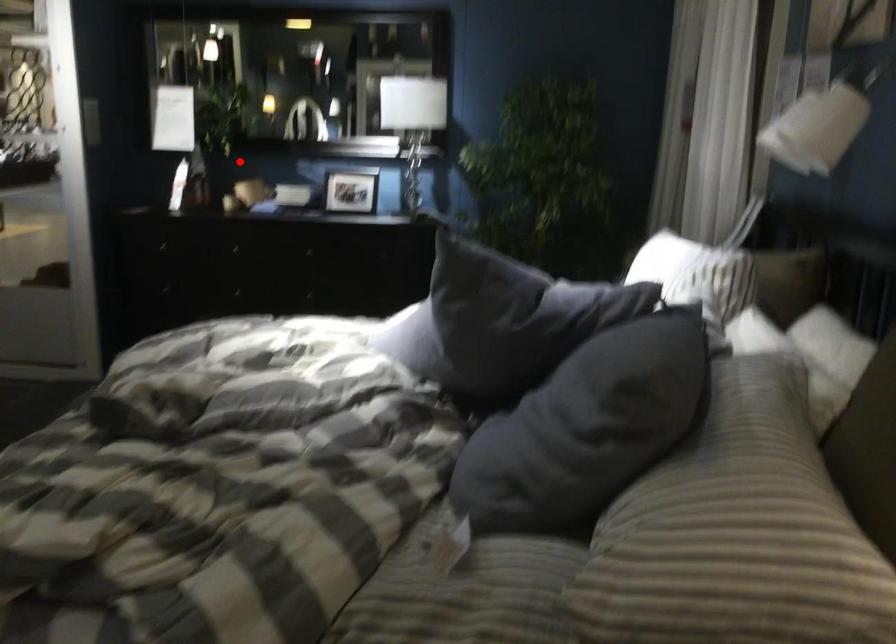
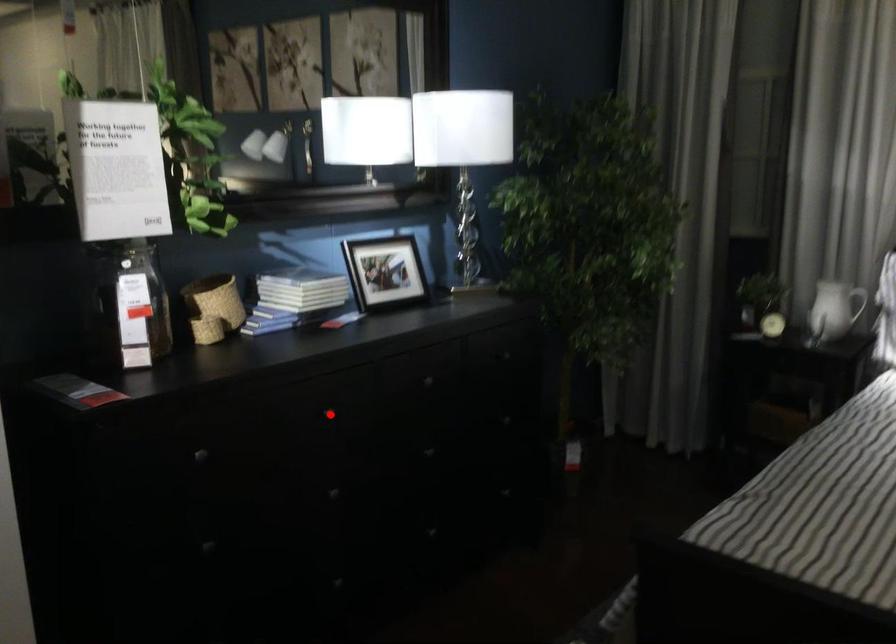
I am providing you with two images of the same scene from different viewpoints. A red point is marked on the first image and another point is marked on the second image. Is the red point in image1 aligned with the point shown in image2?

No